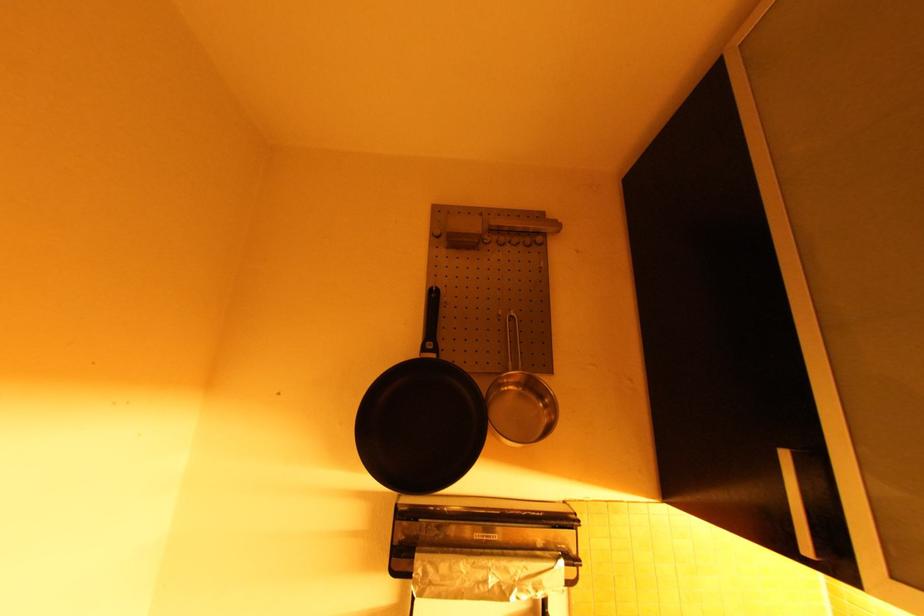
Locate an element on the screen. The image size is (924, 616). black pan handle is located at coordinates (431, 321).